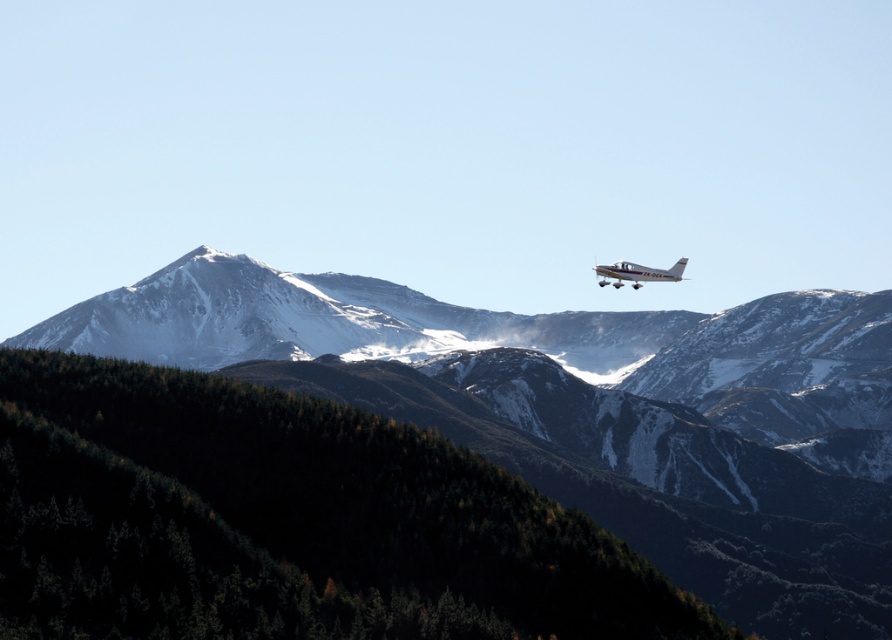
Question: Which object is closer to the camera taking this photo?

Choices:
 (A) snowy rocky mountain range at upper center
 (B) silver metallic airplane at upper right

Answer: (B)

Question: Which of the following is the farthest from the observer?

Choices:
 (A) snowy rocky mountain range at upper center
 (B) silver metallic airplane at upper right

Answer: (A)

Question: Does snowy rocky mountain range at upper center lie behind silver metallic airplane at upper right?

Choices:
 (A) no
 (B) yes

Answer: (B)

Question: Which object appears closest to the camera in this image?

Choices:
 (A) silver metallic airplane at upper right
 (B) snowy rocky mountain range at upper center

Answer: (A)

Question: Is snowy rocky mountain range at upper center wider than silver metallic airplane at upper right?

Choices:
 (A) yes
 (B) no

Answer: (A)

Question: Is snowy rocky mountain range at upper center smaller than silver metallic airplane at upper right?

Choices:
 (A) yes
 (B) no

Answer: (B)